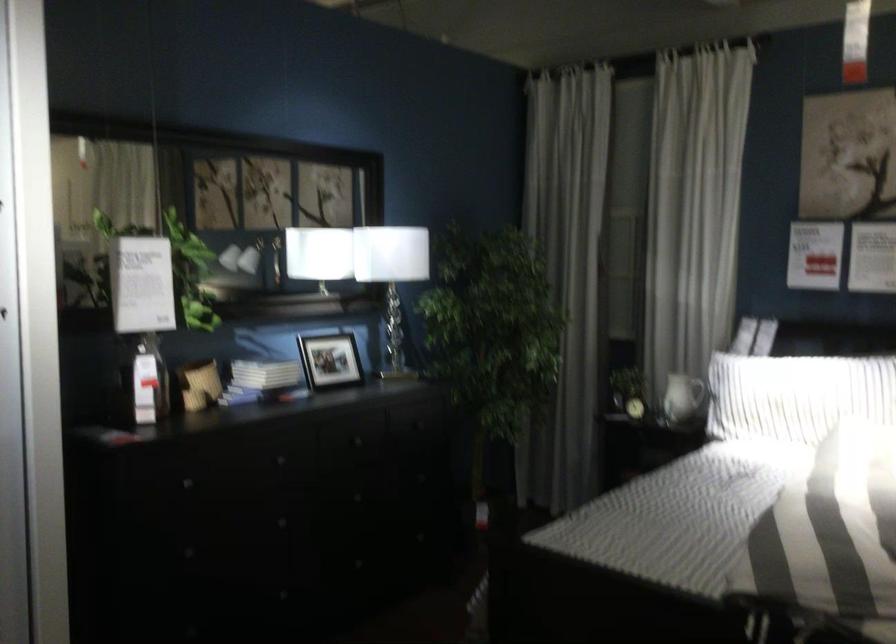
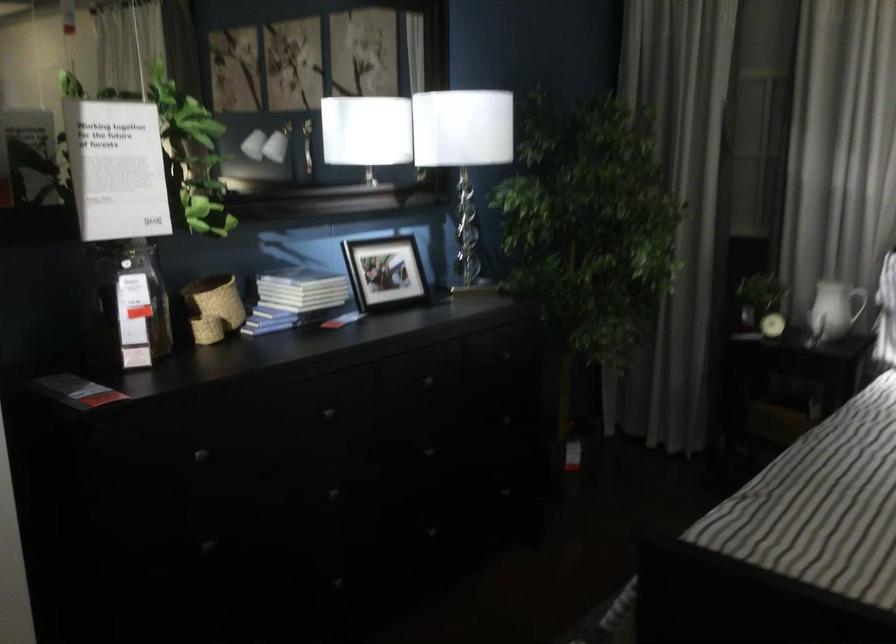
In the second image, find the point that corresponds to pixel 670 398 in the first image.

(823, 313)